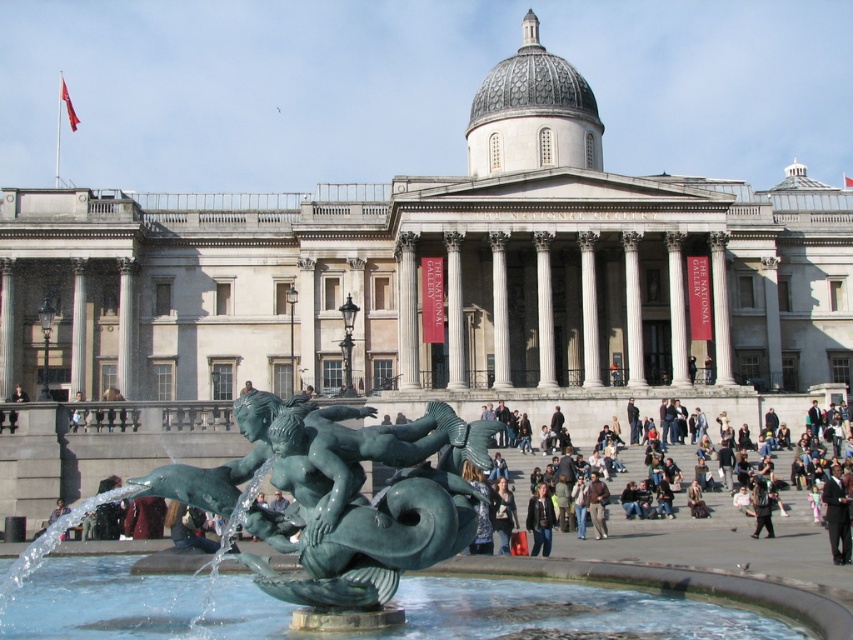
Question: Which is farther from the black suit at lower right?

Choices:
 (A) leather jacket at center
 (B) green patina bronze at lower center

Answer: (B)

Question: Does denim jacket at lower center have a larger size compared to dark brown leather jacket at lower right?

Choices:
 (A) yes
 (B) no

Answer: (A)

Question: Estimate the real-world distances between objects in this image. Which object is closer to the denim jacket at lower center?

Choices:
 (A) light brown leather jacket at lower center
 (B) gray stone dome at center
 (C) leather jacket at center

Answer: (C)

Question: Which object is positioned closest to the denim jacket at lower center?

Choices:
 (A) light brown leather jacket at lower center
 (B) green patina bronze at lower center

Answer: (B)

Question: Is black suit at lower right to the right of light brown leather jacket at lower center from the viewer's perspective?

Choices:
 (A) no
 (B) yes

Answer: (B)

Question: Is green patina bronze at lower center to the right of gray stone dome at center from the viewer's perspective?

Choices:
 (A) no
 (B) yes

Answer: (A)